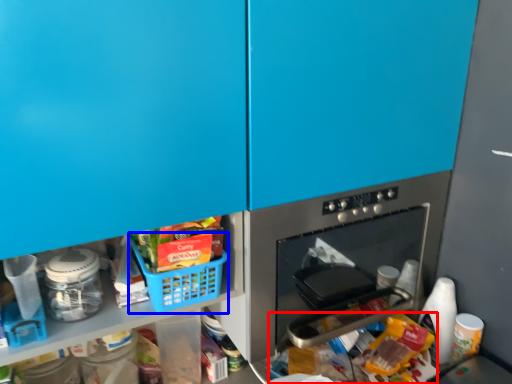
Question: Which point is closer to the camera, food (highlighted by a red box) or basket (highlighted by a blue box)?

Choices:
 (A) food
 (B) basket

Answer: (A)